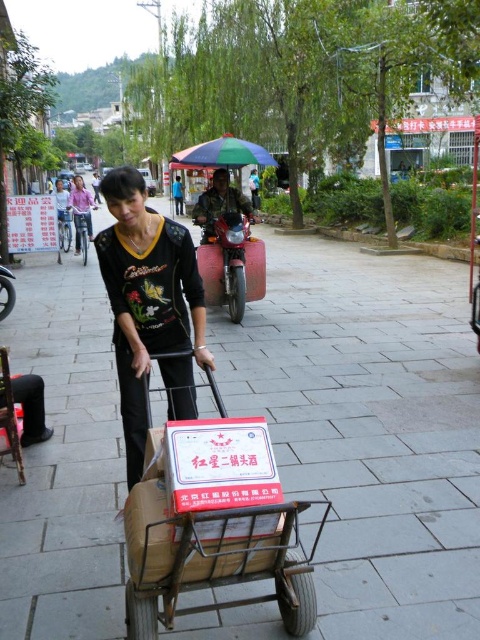
Can you confirm if metallic brown trolley at center is positioned below metallic helmet at center?

Yes.

Is point (156, 513) positioned in front of point (212, 186)?

Yes.

Find the location of a particular element. metallic brown trolley at center is located at coordinates (213, 522).

I want to click on metallic brown trolley at center, so click(x=213, y=522).

Is matte black shirt at center shorter than blue fabric umbrella at upper center?

No, matte black shirt at center is not shorter than blue fabric umbrella at upper center.

Can you confirm if matte black shirt at center is positioned to the left of blue fabric umbrella at upper center?

Indeed, matte black shirt at center is positioned on the left side of blue fabric umbrella at upper center.

Between point (92, 208) and point (181, 212), which one is positioned behind?

Point (181, 212)

The width and height of the screenshot is (480, 640). In order to click on matte black shirt at center in this screenshot , I will do `click(81, 209)`.

Between gray concrete pavement at center and metallic brown trolley at center, which one has more height?

Standing taller between the two is gray concrete pavement at center.

In the scene shown: Who is positioned more to the right, gray concrete pavement at center or metallic brown trolley at center?

From the viewer's perspective, metallic brown trolley at center appears more on the right side.

Between point (55, 444) and point (176, 611), which one is positioned in front?

Point (176, 611) is more forward.

The height and width of the screenshot is (640, 480). Identify the location of gray concrete pavement at center. (370, 428).